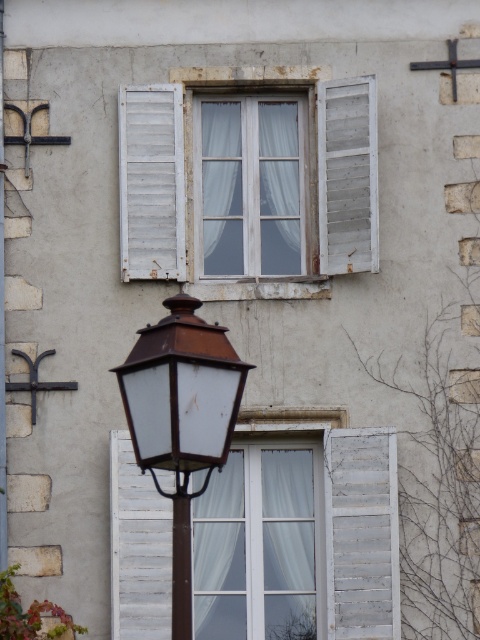
Can you confirm if white wooden window at center is smaller than white wooden shutter at upper left?

Incorrect, white wooden window at center is not smaller in size than white wooden shutter at upper left.

Does white wooden window at center have a greater height compared to white wooden shutter at upper left?

No, white wooden window at center is not taller than white wooden shutter at upper left.

Is point (120, 220) farther from camera compared to point (175, 177)?

No, (120, 220) is in front of (175, 177).

Find the location of a particular element. white wooden window at center is located at coordinates (166, 170).

Does point (127, 372) come closer to viewer compared to point (139, 275)?

Yes.

Which is more to the left, brown matte street light at lower center or white wooden shutter at upper left?

white wooden shutter at upper left

Who is more forward, (157, 387) or (183, 259)?

Positioned in front is point (157, 387).

Image resolution: width=480 pixels, height=640 pixels. I want to click on brown matte street light at lower center, so click(181, 417).

Between white sheer curtain at center and white wooden shutter at upper left, which one is positioned higher?

white wooden shutter at upper left

Which is more to the left, white sheer curtain at center or white wooden shutter at upper left?

white wooden shutter at upper left

Between point (312, 499) and point (182, 173), which one is positioned behind?

The point (312, 499) is more distant.

You are a GUI agent. You are given a task and a screenshot of the screen. Output one action in this format:
    pyautogui.click(x=<x>, y=<y>)
    Task: Click on the white sheer curtain at center
    The height and width of the screenshot is (640, 480).
    Given the screenshot: What is the action you would take?
    pyautogui.click(x=255, y=547)